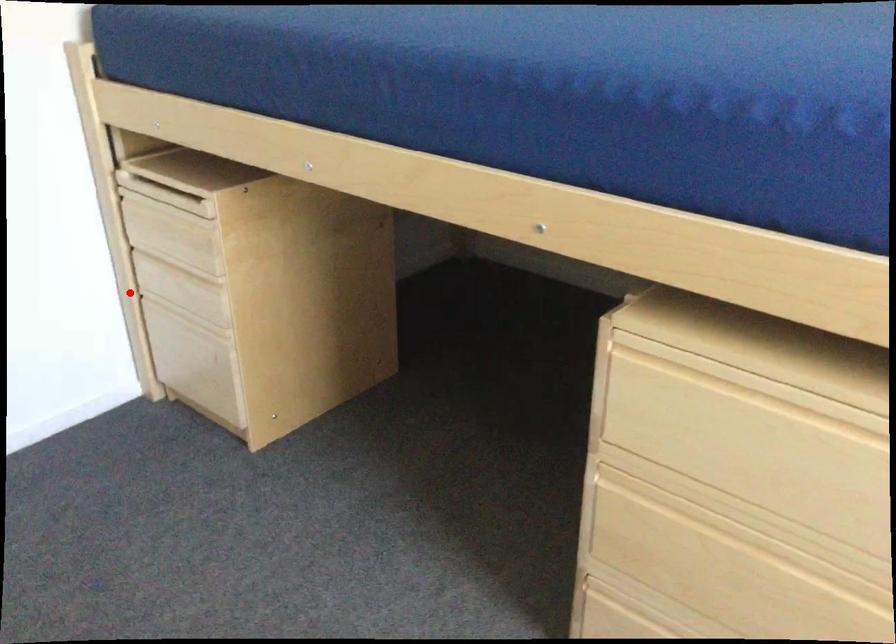
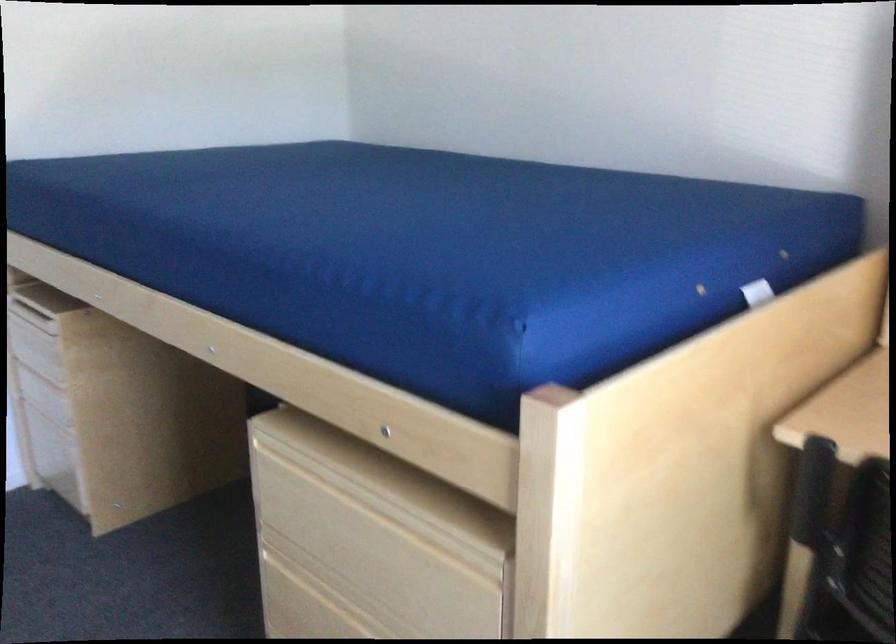
Question: I am providing you with two images of the same scene from different viewpoints. Given a red point in image1, look at the same physical point in image2. Is it:

Choices:
 (A) Closer to the viewpoint
 (B) Farther from the viewpoint

Answer: (B)